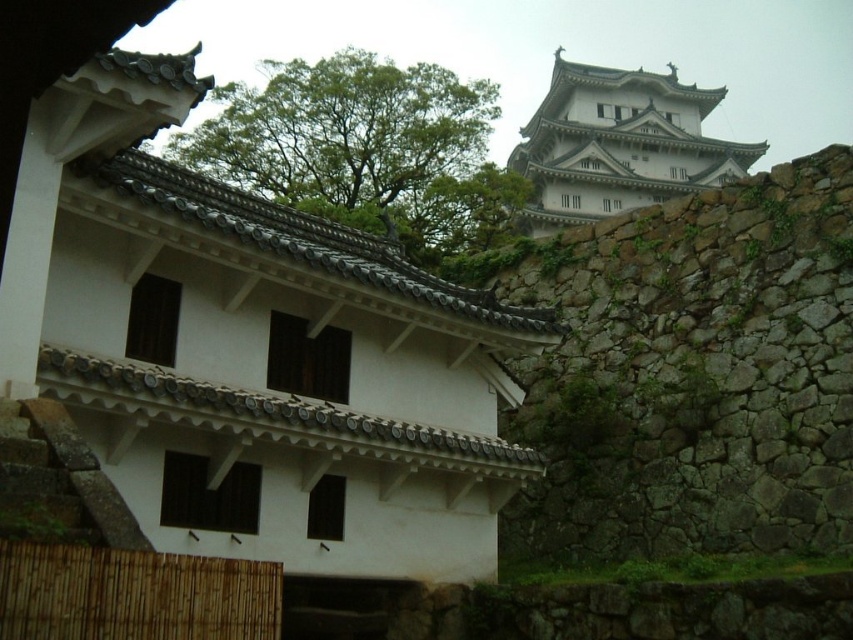
Between white tile roof at center and white stone tower at upper center, which one appears on the right side from the viewer's perspective?

Positioned to the right is white stone tower at upper center.

Can you confirm if white tile roof at center is positioned to the left of white stone tower at upper center?

Indeed, white tile roof at center is positioned on the left side of white stone tower at upper center.

Between point (91, 404) and point (567, 212), which one is positioned in front?

Positioned in front is point (91, 404).

Identify the location of white tile roof at center. This screenshot has width=853, height=640. (252, 355).